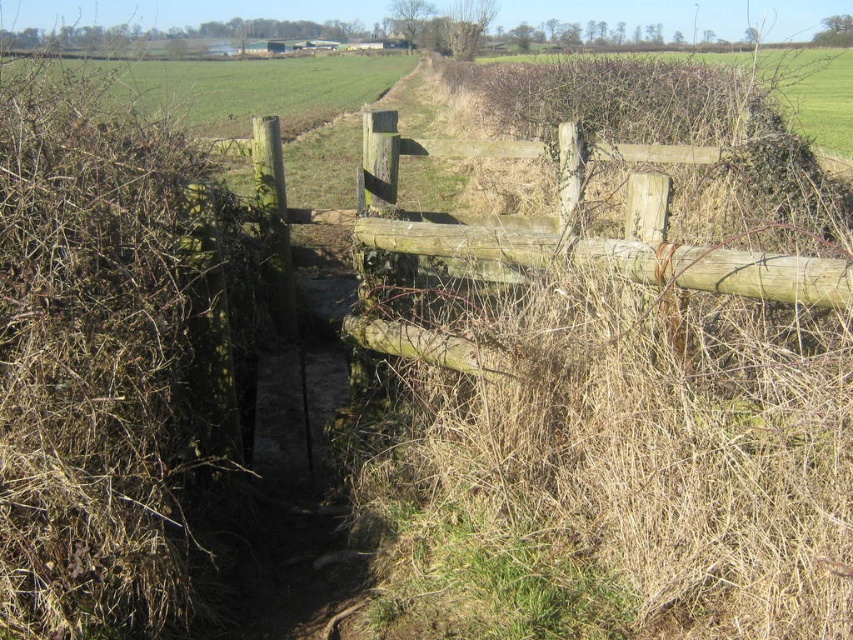
Does point (193, 579) come farther from viewer compared to point (125, 70)?

No.

Is brown dry hedge at left taller than green grass at upper left?

No.

At what (x,y) coordinates should I click in order to perform the action: click on brown dry hedge at left. Please return your answer as a coordinate pair (x, y). Looking at the image, I should click on (113, 358).

Can you confirm if brown dry hedge at left is bigger than brown dry grass at upper center?

Actually, brown dry hedge at left might be smaller than brown dry grass at upper center.

Describe the element at coordinates (113, 358) in the screenshot. I see `brown dry hedge at left` at that location.

Does point (0, 621) lie in front of point (804, 67)?

Yes, point (0, 621) is in front of point (804, 67).

This screenshot has width=853, height=640. I want to click on brown dry hedge at left, so pyautogui.click(x=113, y=358).

What do you see at coordinates (573, 228) in the screenshot? I see `weathered wood gate at center` at bounding box center [573, 228].

Is point (650, 284) farther from viewer compared to point (384, 84)?

No, (650, 284) is in front of (384, 84).

Which is behind, point (451, 256) or point (212, 72)?

The point (212, 72) is behind.

This screenshot has width=853, height=640. Find the location of `weathered wood gate at center`. weathered wood gate at center is located at coordinates tap(573, 228).